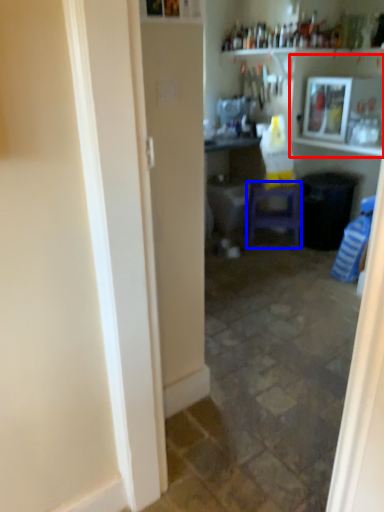
Question: Which object is closer to the camera taking this photo, shelf (highlighted by a red box) or furniture (highlighted by a blue box)?

Choices:
 (A) shelf
 (B) furniture

Answer: (A)